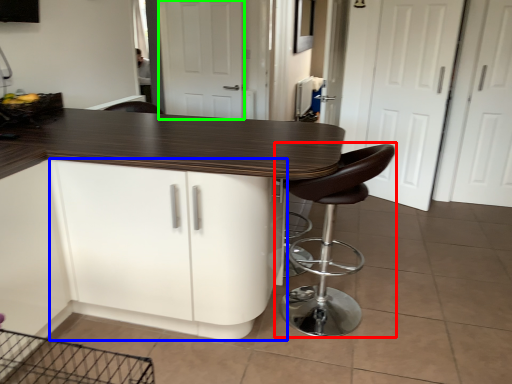
Question: Estimate the real-world distances between objects in this image. Which object is closer to chair (highlighted by a red box), cabinetry (highlighted by a blue box) or screen door (highlighted by a green box)?

Choices:
 (A) cabinetry
 (B) screen door

Answer: (A)